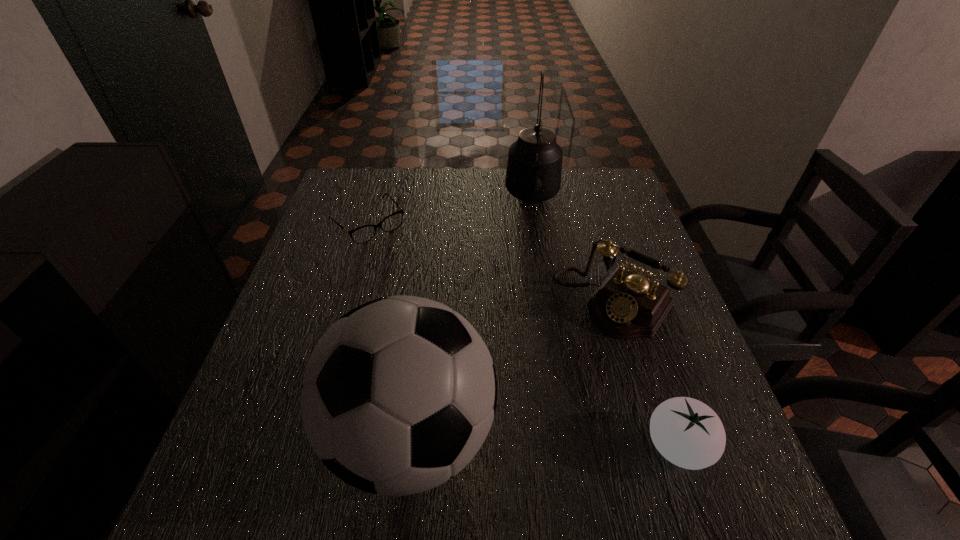
I want to click on vacant region between the shortest object and the telephone, so click(492, 263).

Select which object is the closest to the telephone. Please provide its 2D coordinates. Your answer should be formatted as a tuple, i.e. [(x, y)], where the tuple contains the x and y coordinates of a point satisfying the conditions above.

[(398, 396)]

Identify the location of object that can be found as the closest to the spectacles. This screenshot has height=540, width=960. (534, 167).

Find the location of a particular element. This screenshot has height=540, width=960. free region that satisfies the following two spatial constraints: 1. on the front side of the telephone; 2. on the right side of the second shortest object is located at coordinates (657, 446).